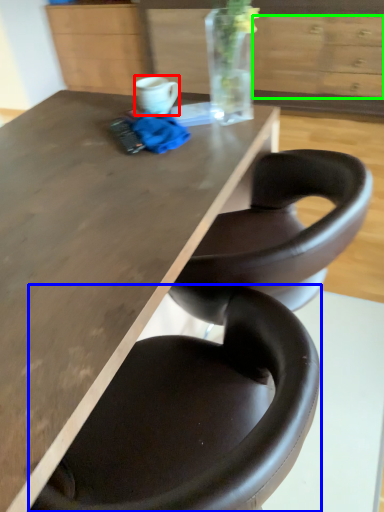
Question: Considering the real-world distances, which object is closest to mug (highlighted by a red box)? chair (highlighted by a blue box) or drawer (highlighted by a green box).

Choices:
 (A) chair
 (B) drawer

Answer: (A)